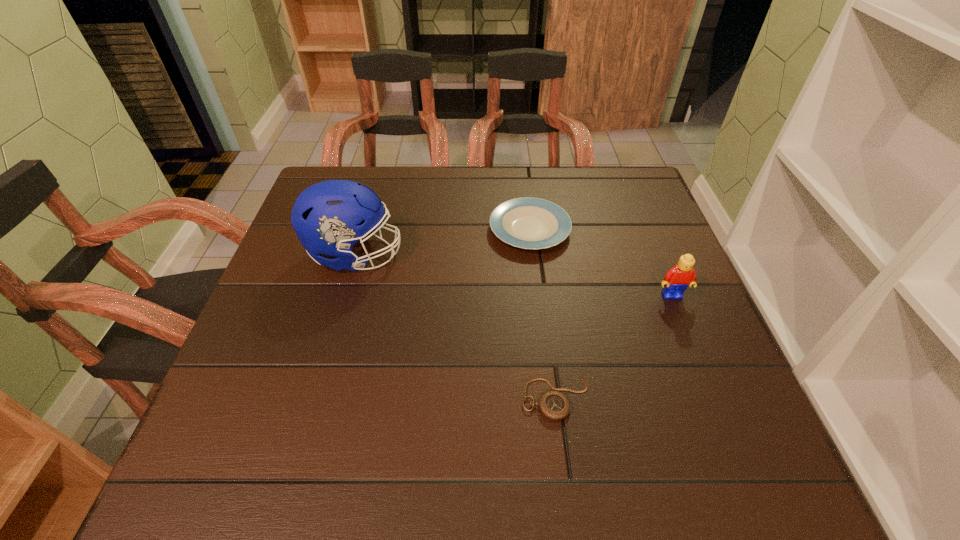
At what (x,y) coordinates should I click in order to perform the action: click on free point located 0.370m on the left of the shortest object. Please return your answer as a coordinate pair (x, y). Image resolution: width=960 pixels, height=540 pixels. Looking at the image, I should click on (320, 397).

Locate an element on the screen. The image size is (960, 540). object located in the far edge section of the desktop is located at coordinates (530, 223).

Where is `object that is at the left edge`? Image resolution: width=960 pixels, height=540 pixels. object that is at the left edge is located at coordinates (330, 217).

Find the location of `object located in the right edge section of the desktop`. object located in the right edge section of the desktop is located at coordinates (682, 275).

Locate an element on the screen. This screenshot has width=960, height=540. vacant point at the far edge is located at coordinates (586, 210).

I want to click on vacant area at the near edge of the desktop, so click(x=538, y=450).

At what (x,y) coordinates should I click in order to perform the action: click on free region at the left edge. Please return your answer as a coordinate pair (x, y). Image resolution: width=960 pixels, height=540 pixels. Looking at the image, I should click on (294, 304).

In the image, there is a desktop. Identify the location of vacant space at the right edge. (693, 428).

Find the location of a particular element. free spot between the second tallest object and the football helmet is located at coordinates (514, 275).

Locate an element on the screen. free space between the third tallest object and the shortest object is located at coordinates [542, 313].